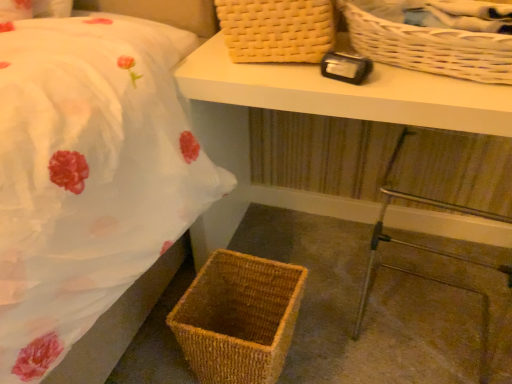
At what (x,y) coordinates should I click in order to perform the action: click on free point above woven wicker basket at lower left (from a real-world perspective). Please return your answer as a coordinate pair (x, y). The height and width of the screenshot is (384, 512). Looking at the image, I should click on (348, 301).